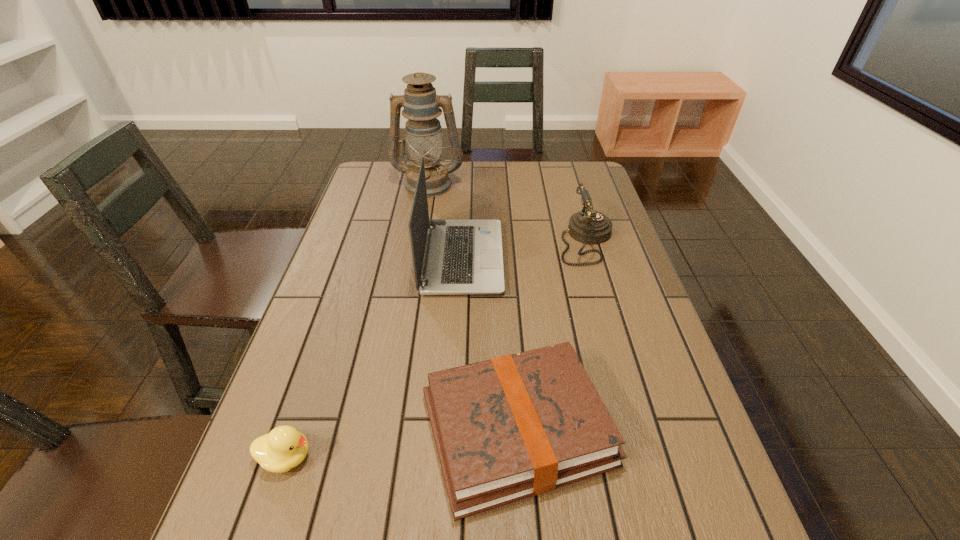
Find the location of `vacant area that lies between the tallest object and the telephone`. vacant area that lies between the tallest object and the telephone is located at coordinates (507, 212).

The width and height of the screenshot is (960, 540). I want to click on vacant region between the duckling and the second tallest object, so click(374, 357).

The width and height of the screenshot is (960, 540). I want to click on free spot between the hardback book and the laptop computer, so click(x=490, y=343).

The height and width of the screenshot is (540, 960). I want to click on free spot between the farthest object and the leftmost object, so click(357, 321).

This screenshot has height=540, width=960. I want to click on unoccupied area between the third shortest object and the laptop computer, so click(524, 249).

Find the location of a particular element. free space between the leftmost object and the third tallest object is located at coordinates (436, 349).

Locate an element on the screen. empty location between the laptop computer and the telephone is located at coordinates (524, 249).

Find the location of a particular element. The width and height of the screenshot is (960, 540). vacant area that lies between the farthest object and the hardback book is located at coordinates (473, 307).

In order to click on free point between the duckling and the second tallest object in this screenshot , I will do `click(374, 357)`.

Select which object appears as the third closest to the farthest object. Please provide its 2D coordinates. Your answer should be formatted as a tuple, i.e. [(x, y)], where the tuple contains the x and y coordinates of a point satisfying the conditions above.

[(515, 426)]